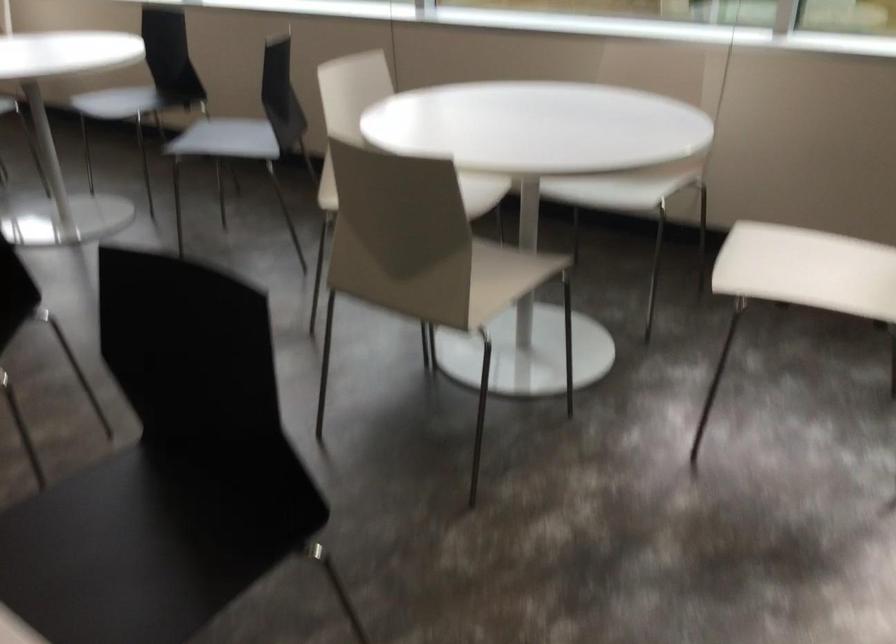
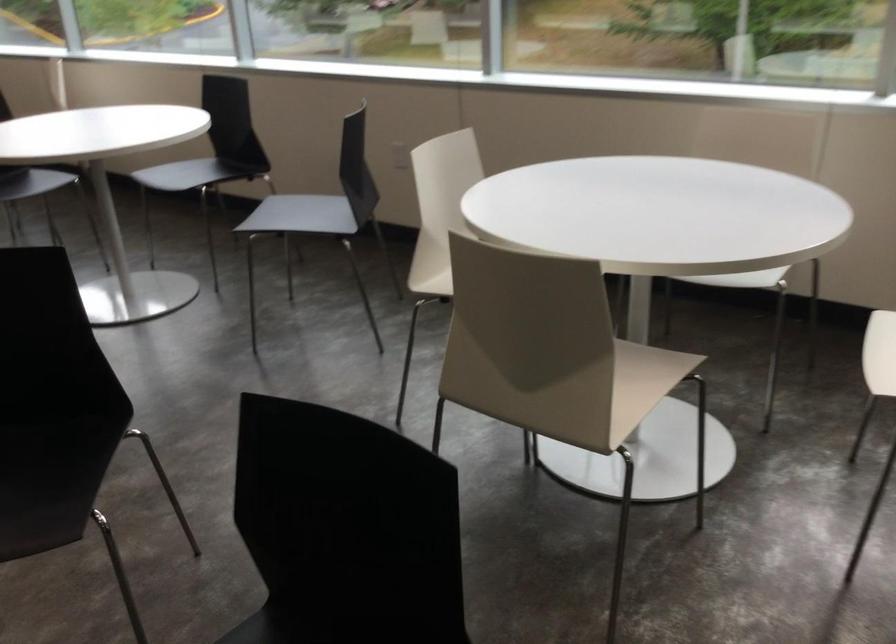
Question: Based on the continuous images, in which direction is the camera rotating? Reply with the corresponding letter.

Choices:
 (A) Left
 (B) Right
 (C) Up
 (D) Down

Answer: (C)